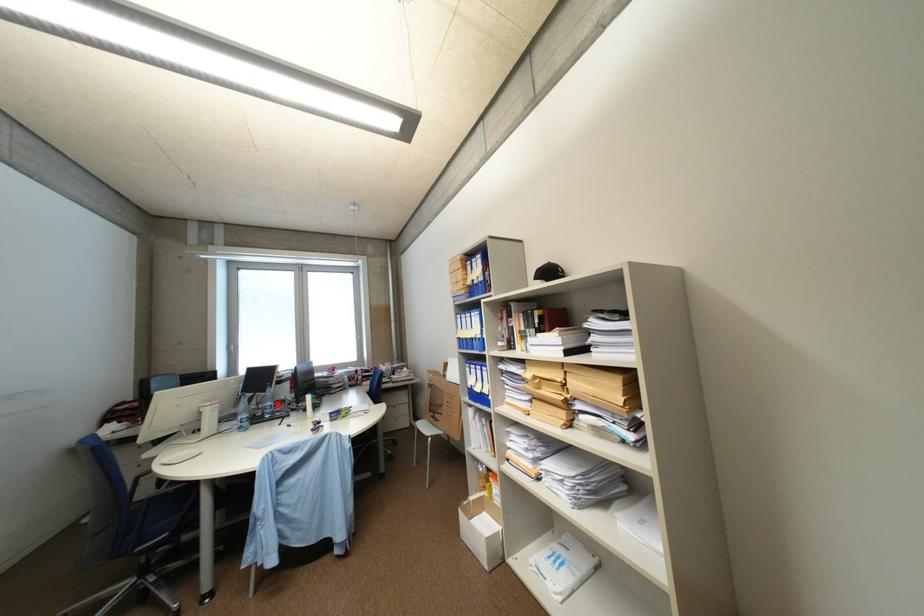
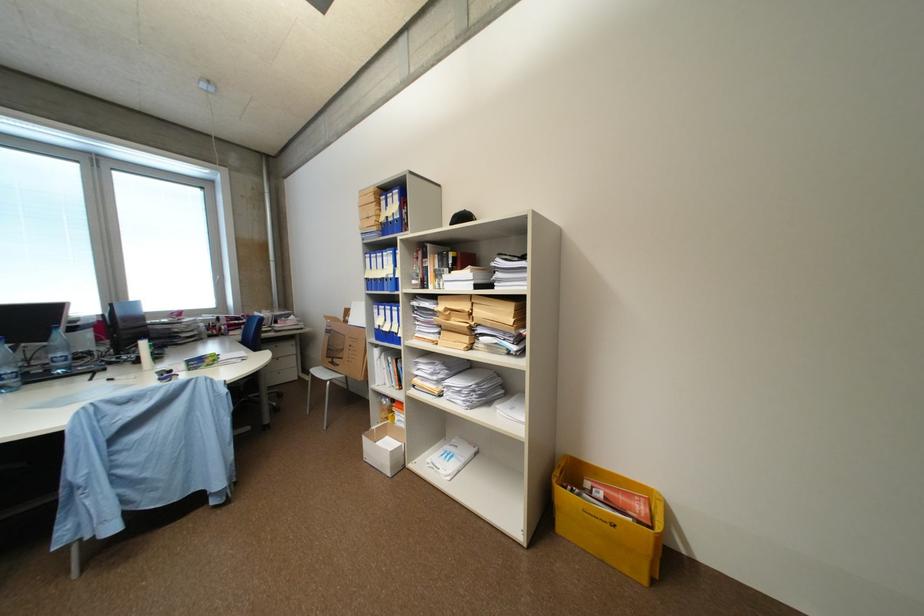
Find the pixel in the second image that matches the highlighted location in the first image.

(68, 355)